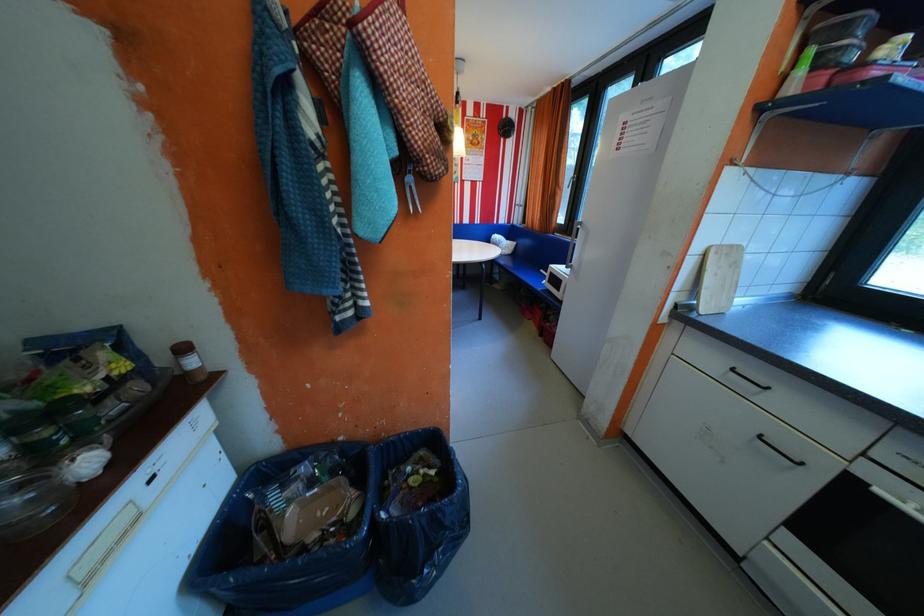
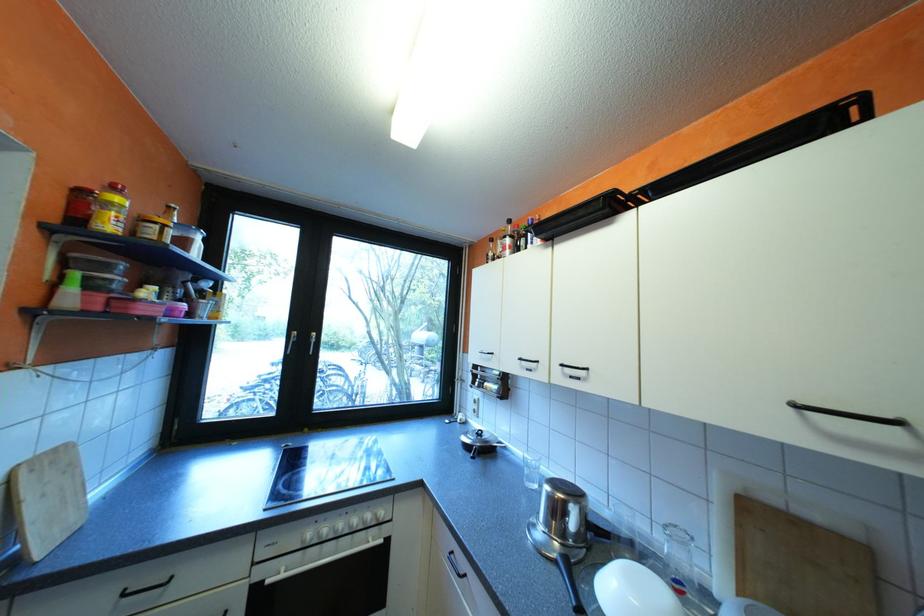
In the second image, find the point that corresponds to pixel 883 454 in the first image.

(268, 559)